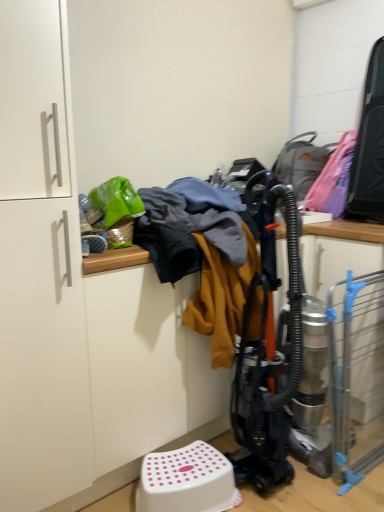
Question: Does white plastic step stool at lower center have a lesser height compared to green plastic bag at upper left?

Choices:
 (A) yes
 (B) no

Answer: (A)

Question: Considering the relative positions of white plastic step stool at lower center and green plastic bag at upper left in the image provided, is white plastic step stool at lower center behind green plastic bag at upper left?

Choices:
 (A) yes
 (B) no

Answer: (B)

Question: Considering the relative sizes of white plastic step stool at lower center and green plastic bag at upper left in the image provided, is white plastic step stool at lower center thinner than green plastic bag at upper left?

Choices:
 (A) no
 (B) yes

Answer: (B)

Question: Can you confirm if white plastic step stool at lower center is positioned to the left of green plastic bag at upper left?

Choices:
 (A) yes
 (B) no

Answer: (B)

Question: Does white plastic step stool at lower center have a larger size compared to green plastic bag at upper left?

Choices:
 (A) no
 (B) yes

Answer: (B)

Question: Can you confirm if white plastic step stool at lower center is taller than green plastic bag at upper left?

Choices:
 (A) yes
 (B) no

Answer: (B)

Question: Does white matte cabinet at left appear on the right side of green plastic bag at upper left?

Choices:
 (A) yes
 (B) no

Answer: (B)

Question: Can you confirm if white matte cabinet at left is taller than green plastic bag at upper left?

Choices:
 (A) no
 (B) yes

Answer: (B)

Question: From the image's perspective, is white matte cabinet at left under green plastic bag at upper left?

Choices:
 (A) no
 (B) yes

Answer: (B)

Question: Is white matte cabinet at left positioned with its back to green plastic bag at upper left?

Choices:
 (A) no
 (B) yes

Answer: (A)

Question: Are white matte cabinet at left and green plastic bag at upper left far apart?

Choices:
 (A) no
 (B) yes

Answer: (A)

Question: Considering the relative positions of white matte cabinet at left and green plastic bag at upper left in the image provided, is white matte cabinet at left behind green plastic bag at upper left?

Choices:
 (A) no
 (B) yes

Answer: (A)

Question: Are green plastic basket at upper left and green plastic bag at upper left far apart?

Choices:
 (A) yes
 (B) no

Answer: (B)